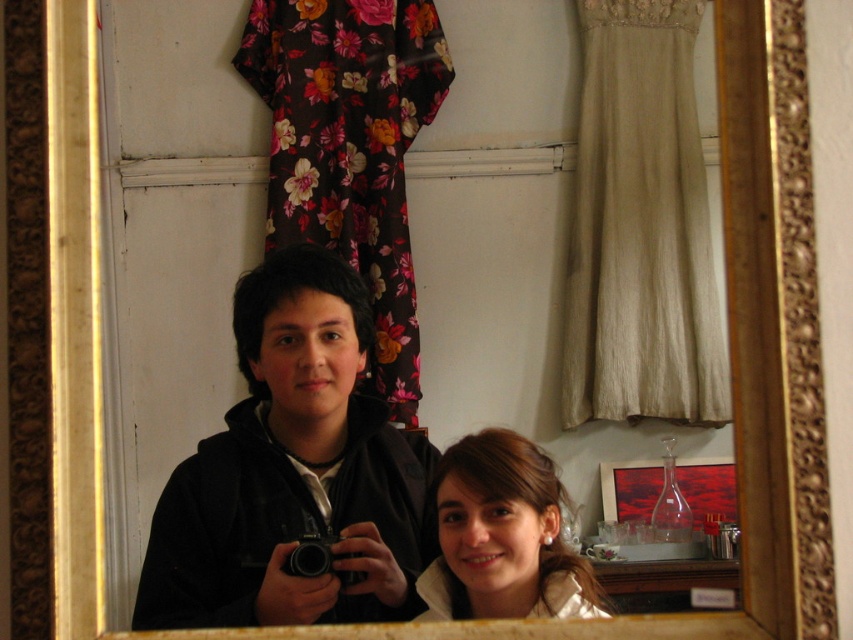
Is point (415, 561) positioned behind point (422, 579)?

That is True.

Does black matte jacket at center have a larger size compared to smooth brown hair at lower right?

Correct, black matte jacket at center is larger in size than smooth brown hair at lower right.

Where is `black matte jacket at center`? black matte jacket at center is located at coordinates (294, 470).

Image resolution: width=853 pixels, height=640 pixels. I want to click on black matte jacket at center, so click(x=294, y=470).

Which is in front, point (488, 579) or point (282, 568)?

Point (488, 579)

Measure the distance between smooth brown hair at lower right and black plastic camera at center.

The distance of smooth brown hair at lower right from black plastic camera at center is 8.33 inches.

Which is behind, point (495, 614) or point (328, 572)?

The point (328, 572) is more distant.

In order to click on smooth brown hair at lower right in this screenshot , I will do `click(502, 536)`.

Locate an element on the screen. This screenshot has height=640, width=853. black matte jacket at center is located at coordinates (294, 470).

You are a GUI agent. You are given a task and a screenshot of the screen. Output one action in this format:
    pyautogui.click(x=<x>, y=<y>)
    Task: Click on the black matte jacket at center
    Image resolution: width=853 pixels, height=640 pixels.
    Given the screenshot: What is the action you would take?
    pyautogui.click(x=294, y=470)

Identify the location of black matte jacket at center. (294, 470).